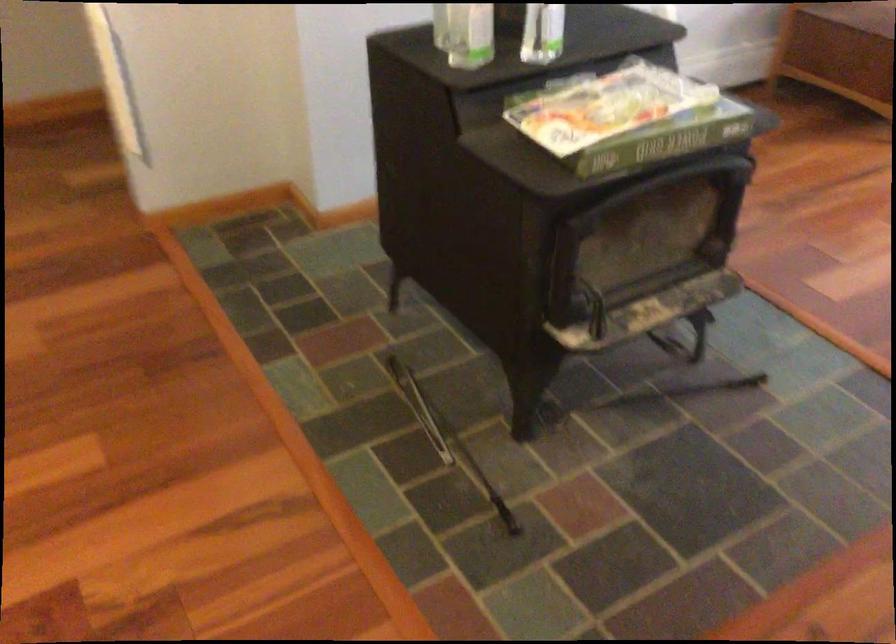
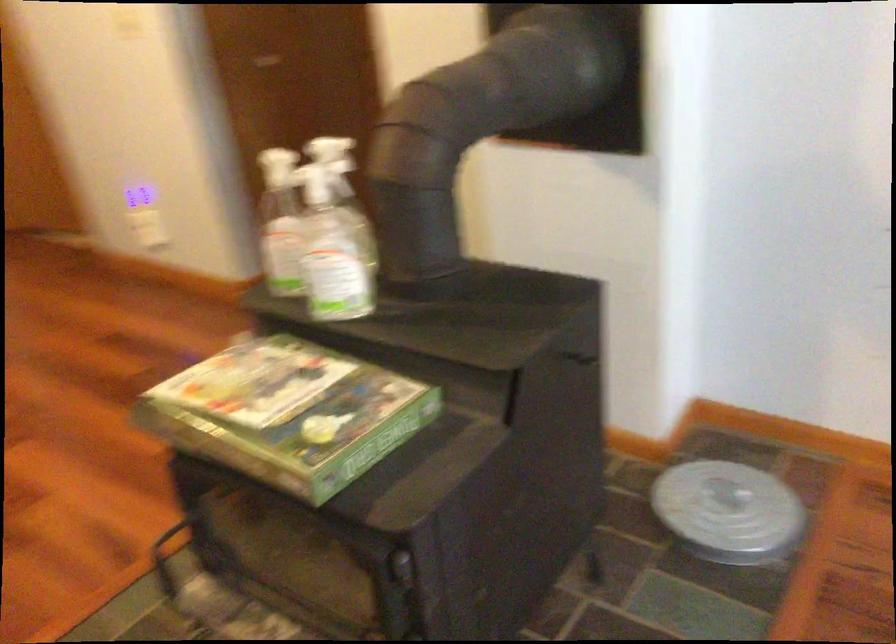
Locate, in the second image, the point that corresponds to the point at 655,104 in the first image.

(289, 413)